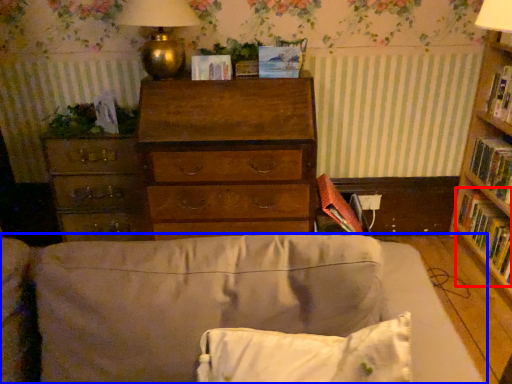
Question: Among these objects, which one is farthest to the camera, book (highlighted by a red box) or studio couch (highlighted by a blue box)?

Choices:
 (A) book
 (B) studio couch

Answer: (A)